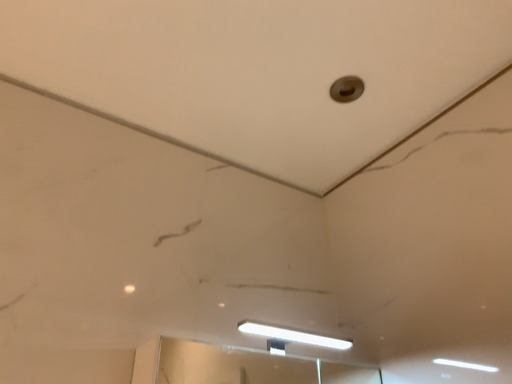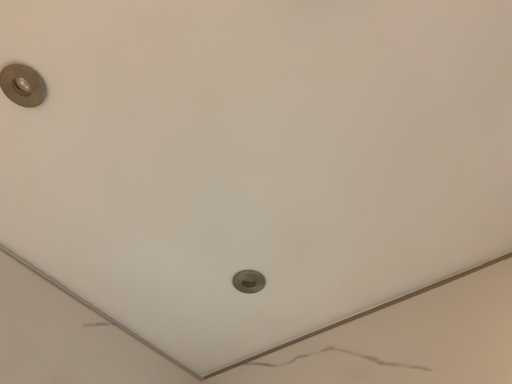
Question: Which way did the camera rotate in the video?

Choices:
 (A) rotated upward
 (B) rotated downward

Answer: (A)